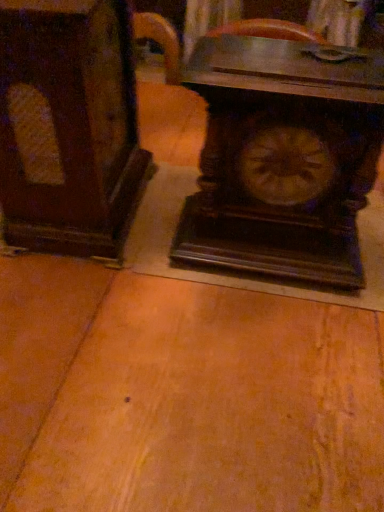
Locate an element on the screen. This screenshot has height=512, width=384. unoccupied area in front of wooden carved clock at center is located at coordinates (266, 344).